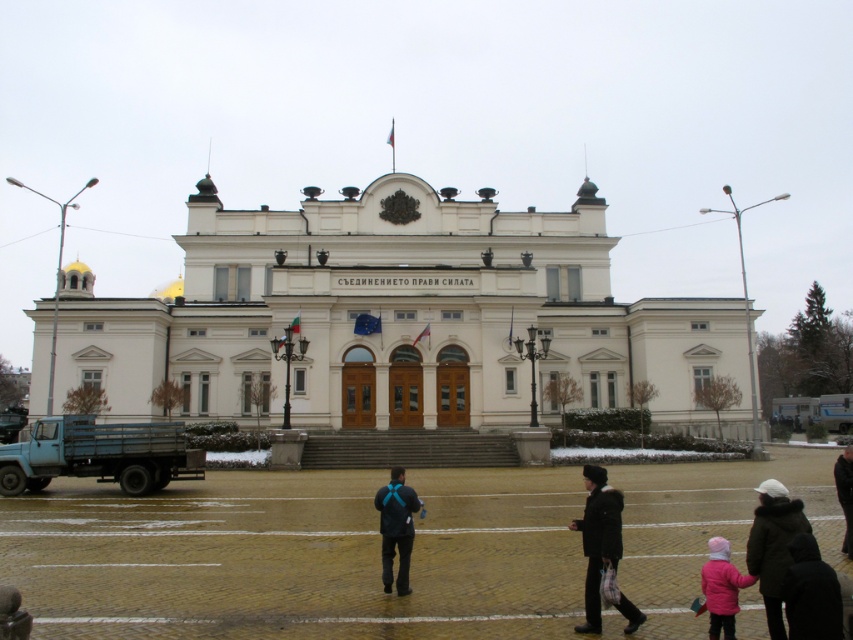
Question: Estimate the real-world distances between objects in this image. Which object is farther from the black matte jacket at center?

Choices:
 (A) black leather jacket at lower right
 (B) dark green jacket at lower right

Answer: (A)

Question: Which object is positioned farthest from the black leather jacket at lower right?

Choices:
 (A) dark green jacket at lower right
 (B) pink fleece jacket at lower right
 (C) black fabric coat at lower right

Answer: (B)

Question: Is black fabric coat at lower right thinner than black matte jacket at center?

Choices:
 (A) no
 (B) yes

Answer: (B)

Question: Based on their relative distances, which object is nearer to the black fuzzy coat at center?

Choices:
 (A) dark green jacket at lower right
 (B) black leather jacket at lower right
 (C) pink fleece jacket at lower right
 (D) black matte jacket at center

Answer: (A)

Question: Is dark green jacket at lower right thinner than black leather jacket at lower right?

Choices:
 (A) yes
 (B) no

Answer: (A)

Question: Can you confirm if pink fleece jacket at lower right is bigger than black leather jacket at lower right?

Choices:
 (A) yes
 (B) no

Answer: (B)